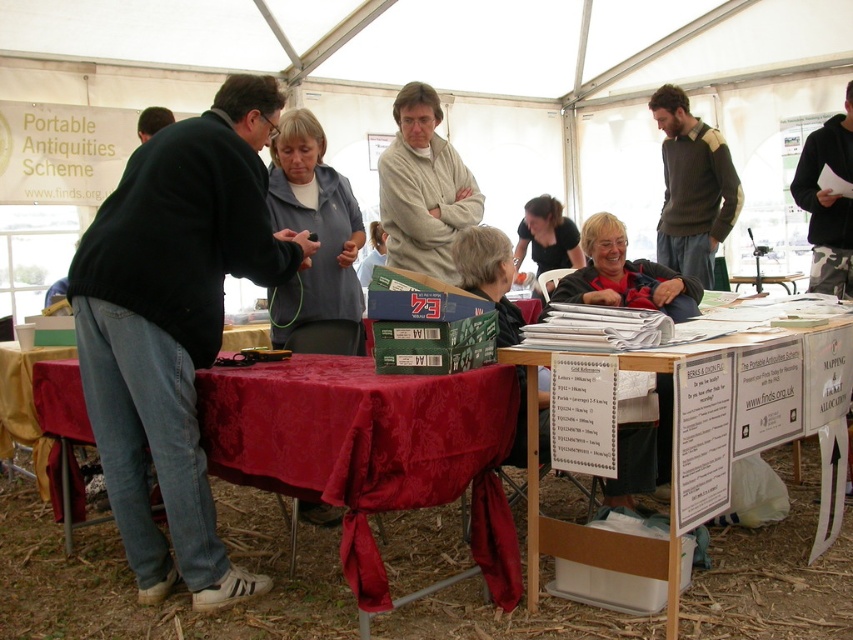
You are an attendee at the archaeology fair and want to pick up both the light beige sweater at center and the dark brown sweater at upper right. Which sweater should you grab first to reach them in the most efficient way?

The light beige sweater at center is positioned on the left side of the dark brown sweater at upper right, so you should grab the light beige sweater at center first to reach them efficiently without moving the dark brown sweater at upper right out of the way.

You are a tailor measuring the distance between two jackets in a tent. The jackets are the black matte jacket at left and the matte black jacket at center. The tent has a narrow walkway that is 1.5 meters wide. Can both jackets be placed side by side on the walkway without overlapping?

The distance between the black matte jacket at left and matte black jacket at center is 1.60 meters, which is wider than the 1.5 meters walkway. Therefore, placing both jackets side by side would cause them to overlap since the required space exceeds the walkway width.

You are a visitor at the archaeology fair and you see two jackets at the center of the table. Which jacket is closer to you, the matte black jacket at center or the gray fleece jacket at center?

The matte black jacket at center is closer to you because the gray fleece jacket at center is behind it.